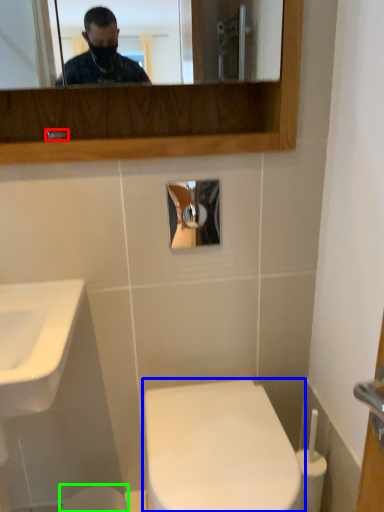
Question: Which object is the farthest from faucet (highlighted by a red box)? Choose among these: toilet (highlighted by a blue box) or toilet bowl (highlighted by a green box).

Choices:
 (A) toilet
 (B) toilet bowl

Answer: (B)